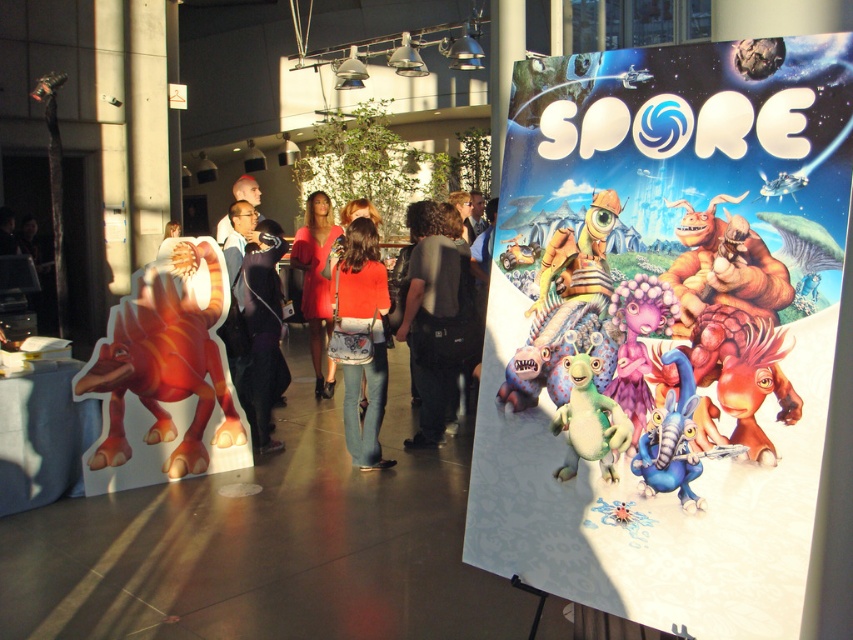
Question: Observing the image, what is the correct spatial positioning of black fabric at center in reference to matte red dress at center?

Choices:
 (A) above
 (B) below

Answer: (B)

Question: Among these objects, which one is nearest to the camera?

Choices:
 (A) orange fabric dress at center
 (B) dark gray fabric backpack at center

Answer: (A)

Question: From the image, what is the correct spatial relationship of matte orange dinosaur at left in relation to green matte toy at center?

Choices:
 (A) right
 (B) left

Answer: (B)

Question: Can you confirm if cartoonish paper poster at center is thinner than matte orange dinosaur at left?

Choices:
 (A) yes
 (B) no

Answer: (A)

Question: Which of these objects is positioned farthest from the green matte toy at center?

Choices:
 (A) black fabric at center
 (B) matte orange shirt at center
 (C) orange fabric dress at center

Answer: (A)

Question: Which of the following is the closest to the observer?

Choices:
 (A) fuzzy brown creature at right
 (B) matte red dress at center
 (C) black fabric at center
 (D) purple matte alien at center

Answer: (A)